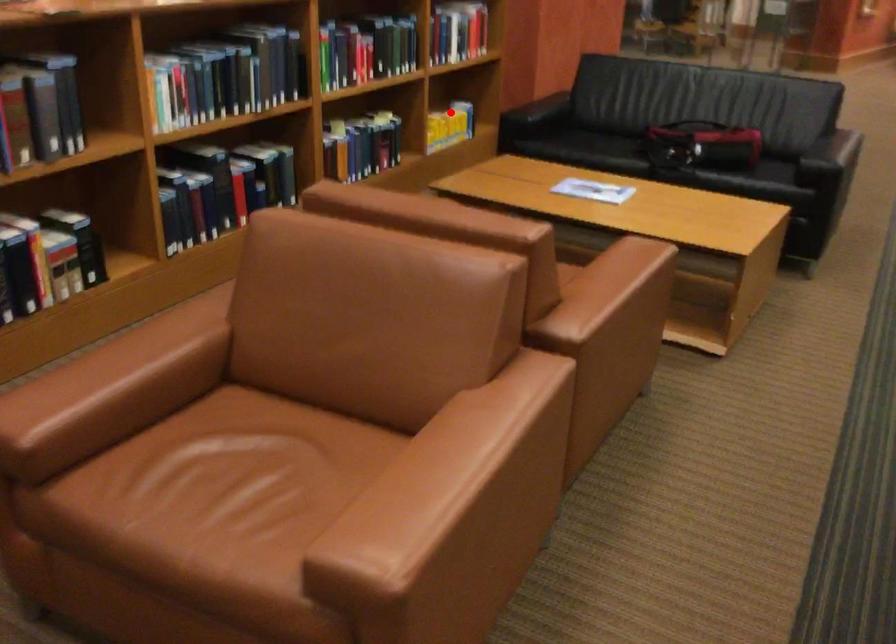
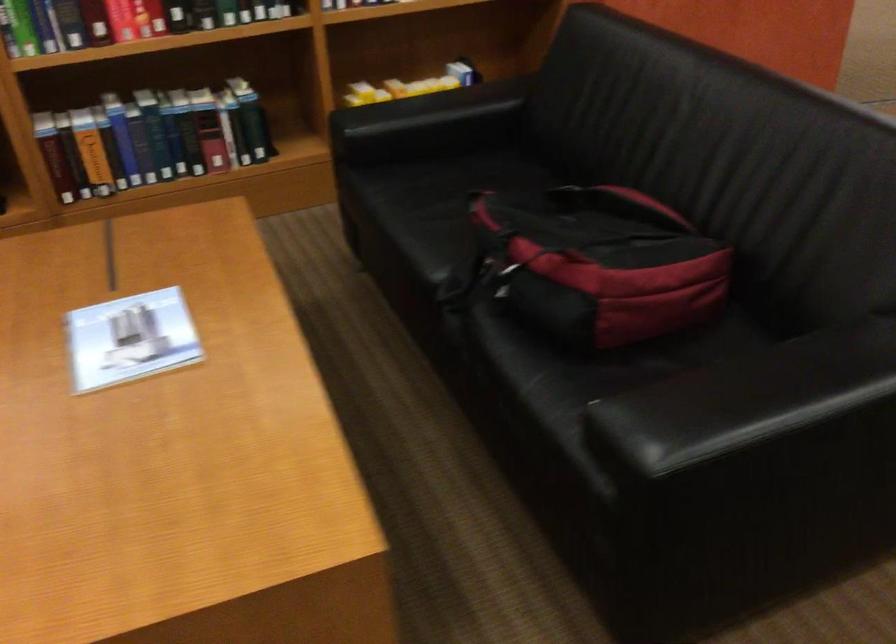
Locate, in the second image, the point that corresponds to the highlighted location in the first image.

(410, 86)